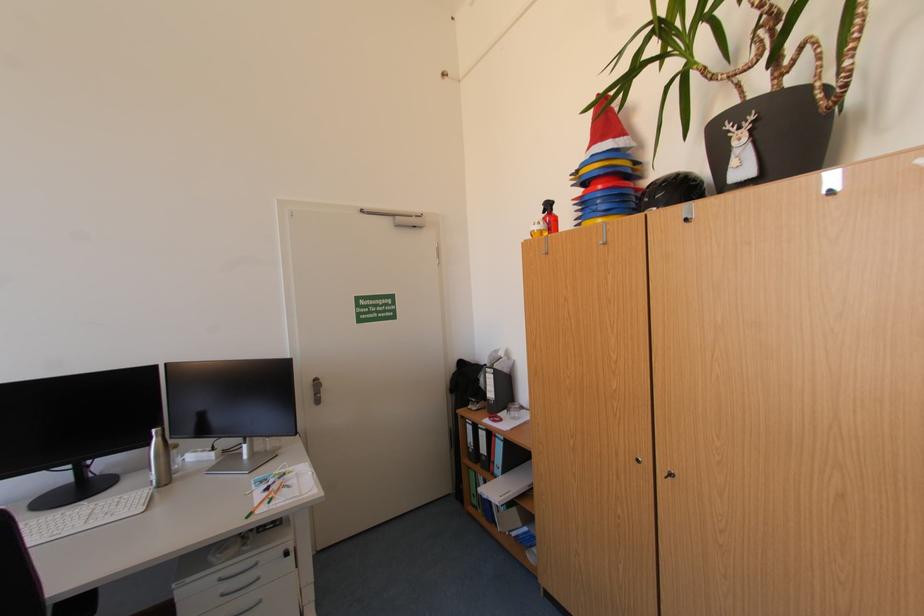
This screenshot has width=924, height=616. Identify the location of metal door handle. (315, 390).